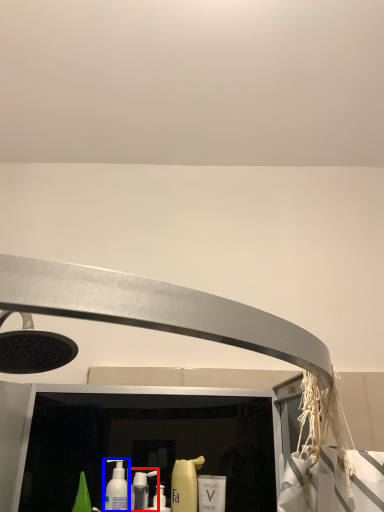
Question: Among these objects, which one is nearest to the camera, cleaning product (highlighted by a red box) or mouthwash (highlighted by a blue box)?

Choices:
 (A) cleaning product
 (B) mouthwash

Answer: (B)